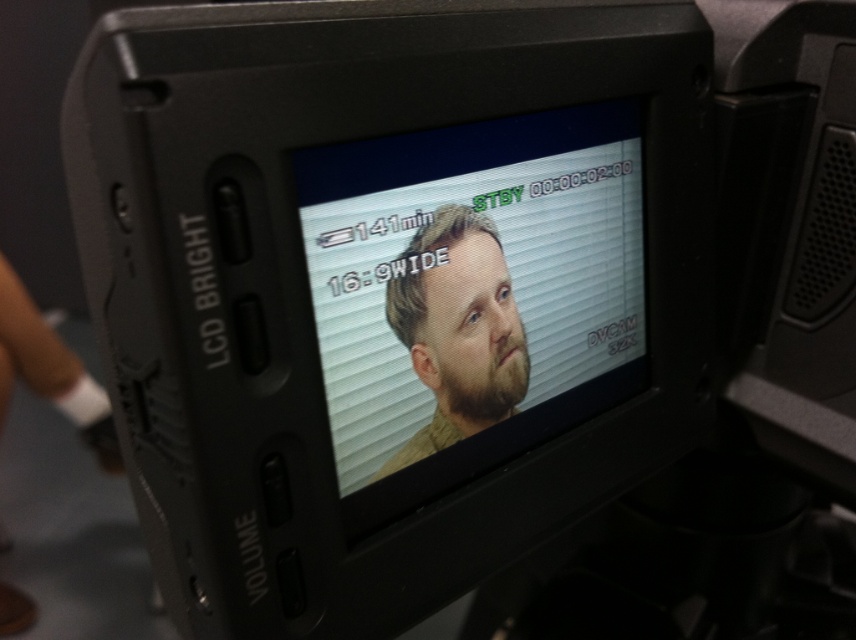
You are setting up a video call and need to adjust the camera angle so that both the matte black monitor at center and the beige fabric face at center are visible. Which object should you move upward to achieve this?

The matte black monitor at center is above the beige fabric face at center. To ensure both are visible, you should move the matte black monitor at center downward or the beige fabric face at center upward. However, since the beige fabric face at center is part of the person, adjusting the camera angle to lower the matte black monitor at center or raise the beige fabric face at center would be necessary.

You are setting up a video call and need to adjust the camera position so that both the matte black monitor at center and the beige fabric face at center are visible. Based on their positions, which object should you move closer to the left side to achieve this?

The beige fabric face at center should be moved closer to the left side because the matte black monitor at center is already positioned to its right. By moving the beige fabric face to the left, both objects will be aligned within the camera frame.